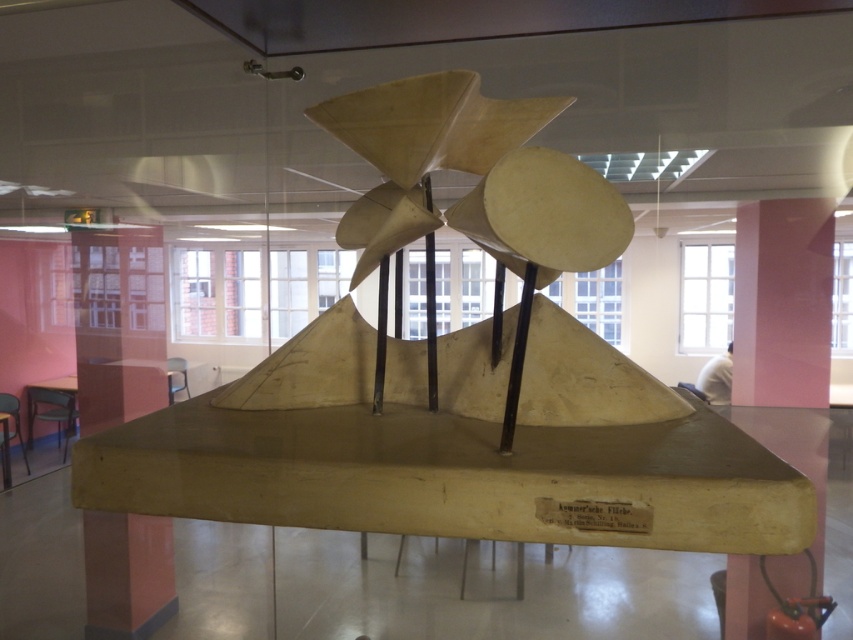
You are standing in front of the turbine model and want to take a photo. You notice two points labeled as point 1 and point 2 on the model. Point 1 is at coordinates point (796, 561) and point 2 is at point (135, 582). Which point will appear closer to the camera in your photo?

Point 1 at coordinates point (796, 561) will appear closer to the camera in the photo because it is closer to the camera than point 2 at point (135, 582).

You are standing in front of the turbine model and want to place a small decorative item on the wooden base. The coordinates for the available space are point A at (782, 301). Is this point suitable for placing the item?

The point at (782, 301) is occupied by a pink matte wooden pillar, so placing an item there would not be possible.